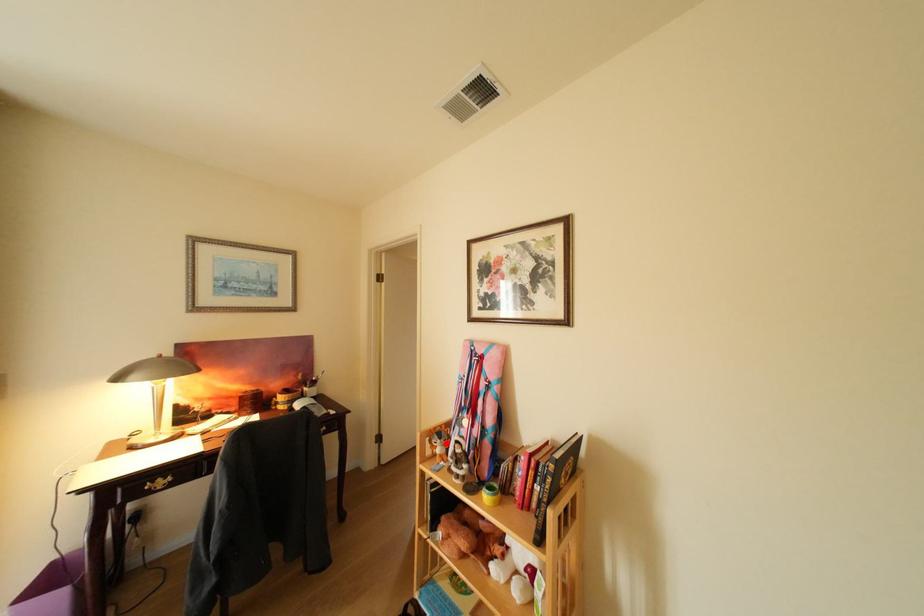
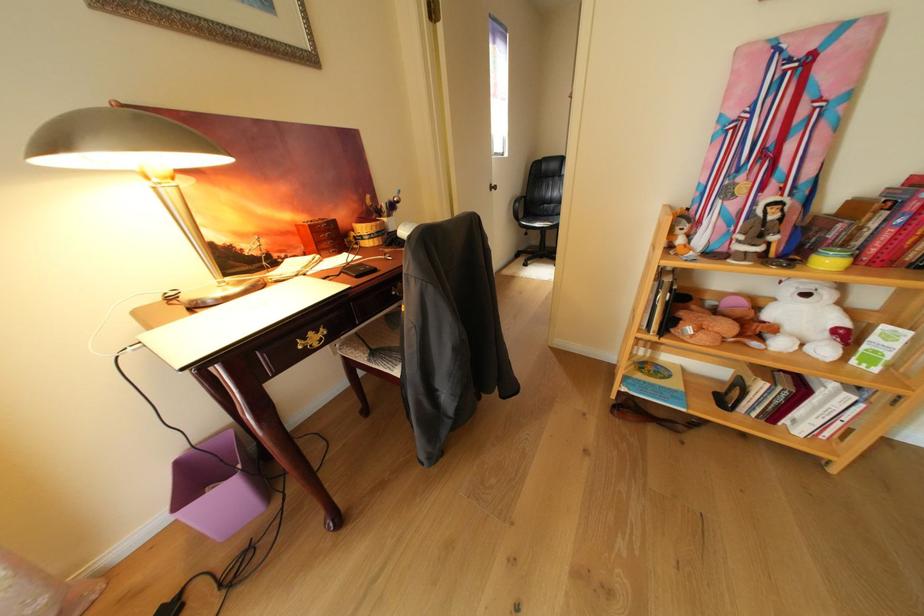
Question: I am providing you with two images of the same scene from different viewpoints. A red point is shown in image1. For the corresponding object point in image2, is it positioned nearer or farther from the camera?

Choices:
 (A) Nearer
 (B) Farther

Answer: (A)